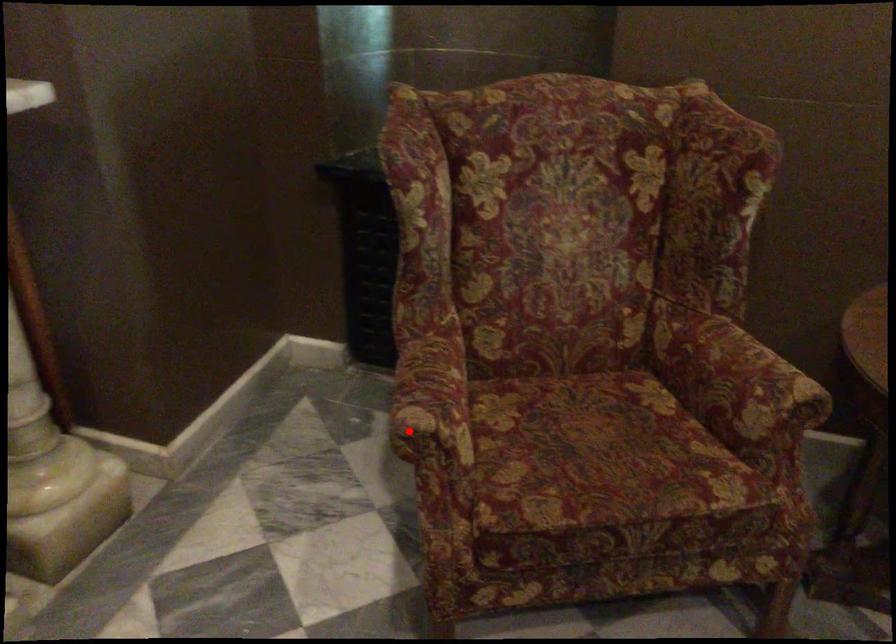
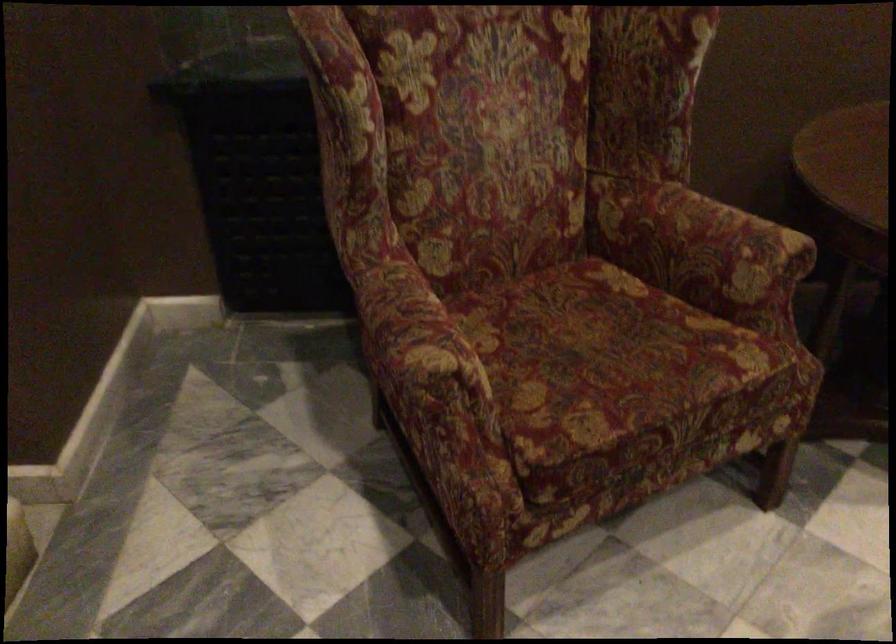
Question: I am providing you with two images of the same scene from different viewpoints. A red point is marked on the first image. Is the red point's position out of view in image 2?

Choices:
 (A) Yes
 (B) No

Answer: (B)